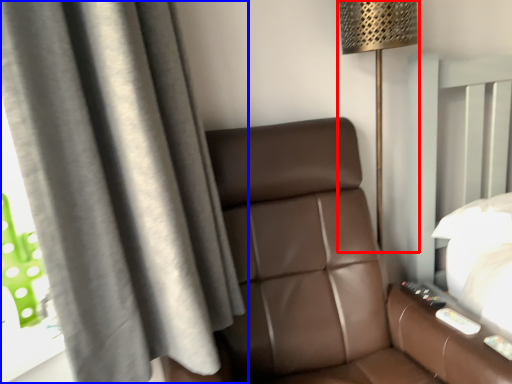
Question: Among these objects, which one is nearest to the camera, lamp (highlighted by a red box) or curtain (highlighted by a blue box)?

Choices:
 (A) lamp
 (B) curtain

Answer: (B)